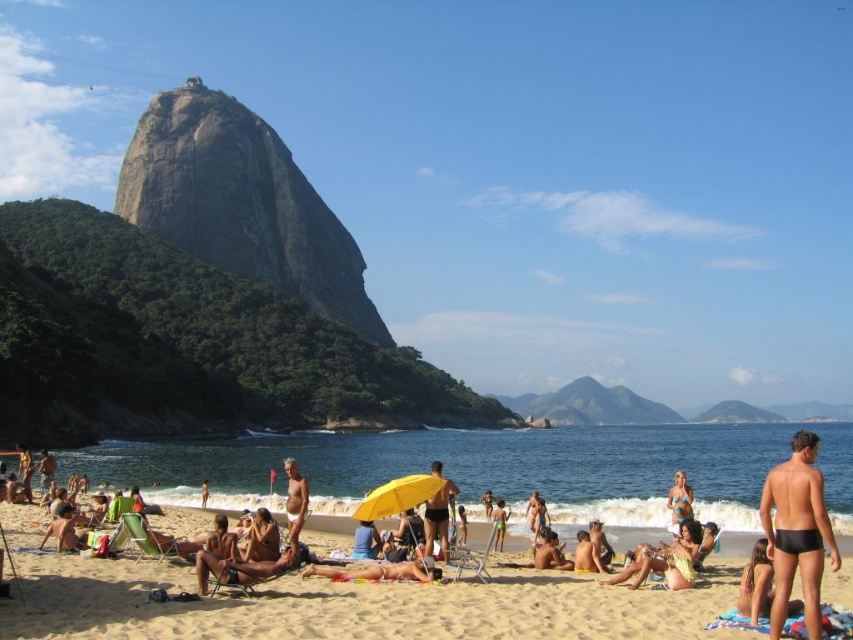
Does yellow matte umbrella at center have a larger size compared to matte yellow umbrella at center?

Correct, yellow matte umbrella at center is larger in size than matte yellow umbrella at center.

Can you confirm if yellow matte umbrella at center is smaller than matte yellow umbrella at center?

No, yellow matte umbrella at center is not smaller than matte yellow umbrella at center.

Is point (366, 508) positioned in front of point (428, 474)?

Yes, point (366, 508) is closer to viewer.

Identify the location of yellow matte umbrella at center. This screenshot has height=640, width=853. (399, 496).

Consider the image. Which of these two, yellow matte umbrella at center or matte blue bikini at center, stands shorter?

With less height is matte blue bikini at center.

In the scene shown: Is yellow matte umbrella at center taller than matte blue bikini at center?

Yes.

Who is more distant from viewer, (387, 502) or (670, 497)?

Point (670, 497)

Where is `yellow matte umbrella at center`? yellow matte umbrella at center is located at coordinates (399, 496).

Who is taller, yellow matte umbrella at center or tan skin person at lower left?

With more height is yellow matte umbrella at center.

Which is above, yellow matte umbrella at center or tan skin person at lower left?

tan skin person at lower left is higher up.

Which is behind, point (392, 484) or point (202, 493)?

Positioned behind is point (202, 493).

Find the location of a particular element. Image resolution: width=853 pixels, height=640 pixels. yellow matte umbrella at center is located at coordinates (399, 496).